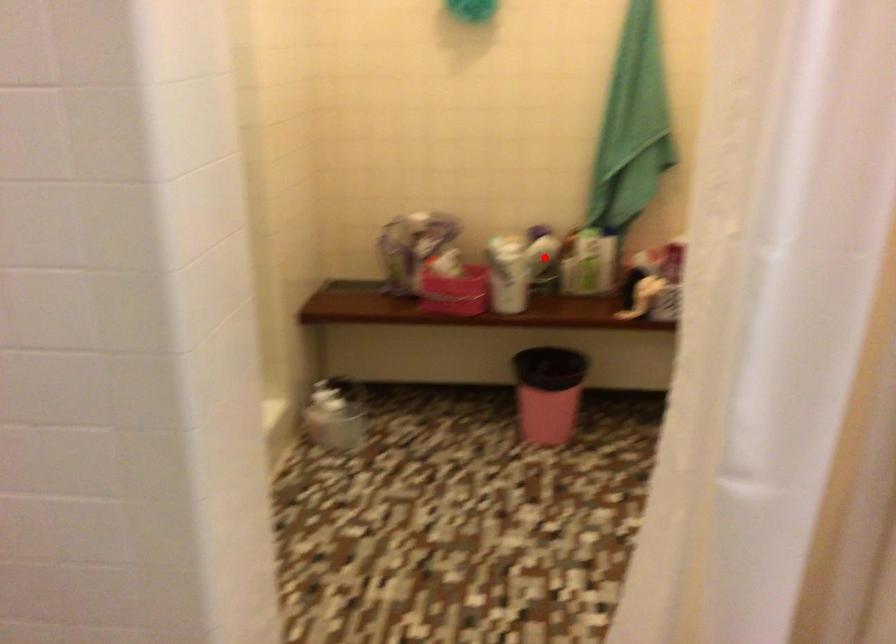
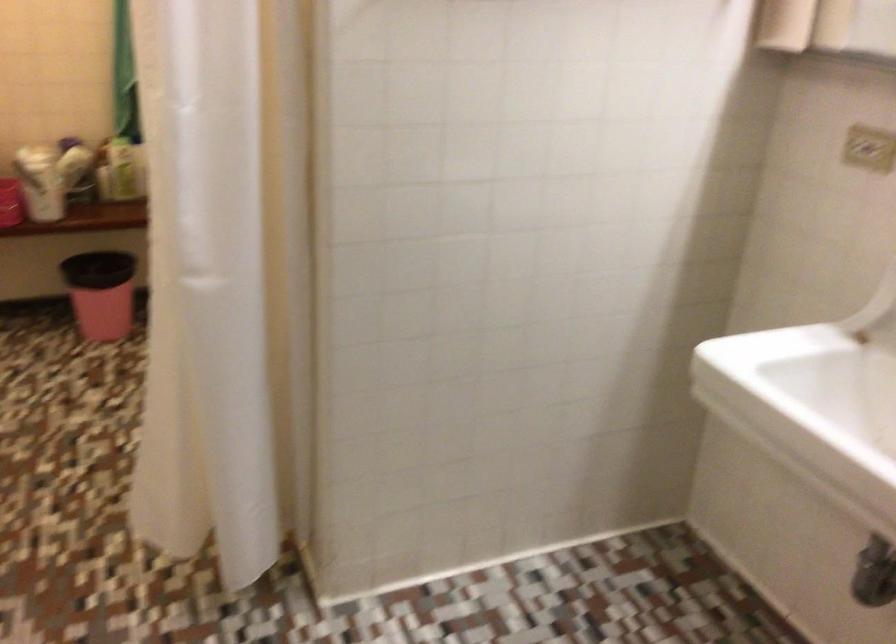
Where in the second image is the point corresponding to the highlighted location from the first image?

(74, 165)